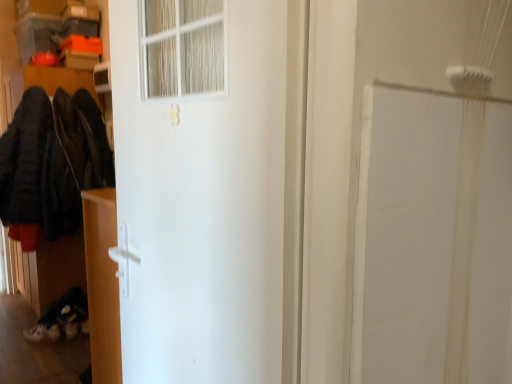
Identify the location of dark woolen coat at left. This screenshot has width=512, height=384. (52, 161).

This screenshot has height=384, width=512. What are the coordinates of `matte white cabinet at lower left` in the screenshot? It's located at (102, 284).

Is matte white cabinet at lower left turned away from white matte door at center?

That's not correct — matte white cabinet at lower left is not looking away from white matte door at center.

Are matte white cabinet at lower left and white matte door at center far apart?

Actually, matte white cabinet at lower left and white matte door at center are a little close together.

Considering the sizes of objects matte white cabinet at lower left and white matte door at center in the image provided, who is wider, matte white cabinet at lower left or white matte door at center?

With larger width is matte white cabinet at lower left.

You are a GUI agent. You are given a task and a screenshot of the screen. Output one action in this format:
    pyautogui.click(x=<x>, y=<y>)
    Task: Click on the furniture that is under the white matte door at center (from a real-world perspective)
    This screenshot has height=384, width=512.
    Given the screenshot: What is the action you would take?
    pyautogui.click(x=102, y=284)

From a real-world perspective, is white matte door at center below matte white cabinet at lower left?

Actually, white matte door at center is physically above matte white cabinet at lower left in the real world.

In terms of width, does white matte door at center look wider or thinner when compared to matte white cabinet at lower left?

white matte door at center is thinner than matte white cabinet at lower left.

Which object is closer to the camera taking this photo, white matte door at center or matte white cabinet at lower left?

Positioned in front is white matte door at center.

Identify the location of door lying in front of the matte white cabinet at lower left. (213, 205).

I want to click on door above the dark woolen coat at left (from a real-world perspective), so click(x=213, y=205).

Considering the sizes of objects dark woolen coat at left and white matte door at center in the image provided, who is shorter, dark woolen coat at left or white matte door at center?

dark woolen coat at left.

From a real-world perspective, is dark woolen coat at left on white matte door at center?

No, from a real-world perspective, dark woolen coat at left is not above white matte door at center.

Can you confirm if dark woolen coat at left is wider than white matte door at center?

Yes.

I want to click on clothing beneath the white matte door at center (from a real-world perspective), so click(52, 161).

Which object is further away from the camera, white matte door at center or dark woolen coat at left?

dark woolen coat at left is further away from the camera.

Between white matte door at center and dark woolen coat at left, which one has larger width?

dark woolen coat at left.

In the scene shown: Can you confirm if dark woolen coat at left is smaller than matte white cabinet at lower left?

Actually, dark woolen coat at left might be larger than matte white cabinet at lower left.

Who is more distant, dark woolen coat at left or matte white cabinet at lower left?

dark woolen coat at left.

Is matte white cabinet at lower left at the back of dark woolen coat at left?

No, dark woolen coat at left is not facing the opposite direction of matte white cabinet at lower left.

Considering the sizes of objects matte white cabinet at lower left and dark woolen coat at left in the image provided, who is smaller, matte white cabinet at lower left or dark woolen coat at left?

Smaller between the two is matte white cabinet at lower left.

Is there a large distance between matte white cabinet at lower left and dark woolen coat at left?

Yes, matte white cabinet at lower left is far from dark woolen coat at left.

From a real-world perspective, between matte white cabinet at lower left and dark woolen coat at left, who is vertically lower?

matte white cabinet at lower left is physically lower.

This screenshot has width=512, height=384. Identify the location of furniture below the white matte door at center (from a real-world perspective). (102, 284).

Image resolution: width=512 pixels, height=384 pixels. Find the location of `furniture that is on the left side of white matte door at center`. furniture that is on the left side of white matte door at center is located at coordinates (102, 284).

Looking at the image, which one is located closer to white matte door at center, matte white cabinet at lower left or dark woolen coat at left?

Based on the image, matte white cabinet at lower left appears to be nearer to white matte door at center.

From the image, which object appears to be nearer to dark woolen coat at left, matte white cabinet at lower left or white matte door at center?

matte white cabinet at lower left lies closer to dark woolen coat at left than the other object.

Estimate the real-world distances between objects in this image. Which object is further from matte white cabinet at lower left, white matte door at center or dark woolen coat at left?

dark woolen coat at left is positioned further to the anchor matte white cabinet at lower left.

Considering their positions, is dark woolen coat at left positioned further to matte white cabinet at lower left than white matte door at center?

Among the two, dark woolen coat at left is located further to matte white cabinet at lower left.

Based on their spatial positions, is white matte door at center or matte white cabinet at lower left closer to dark woolen coat at left?

Based on the image, matte white cabinet at lower left appears to be nearer to dark woolen coat at left.

When comparing their distances from white matte door at center, does dark woolen coat at left or matte white cabinet at lower left seem further?

dark woolen coat at left is further to white matte door at center.

The height and width of the screenshot is (384, 512). What are the coordinates of `furniture between white matte door at center and dark woolen coat at left in the front-back direction` in the screenshot? It's located at (102, 284).